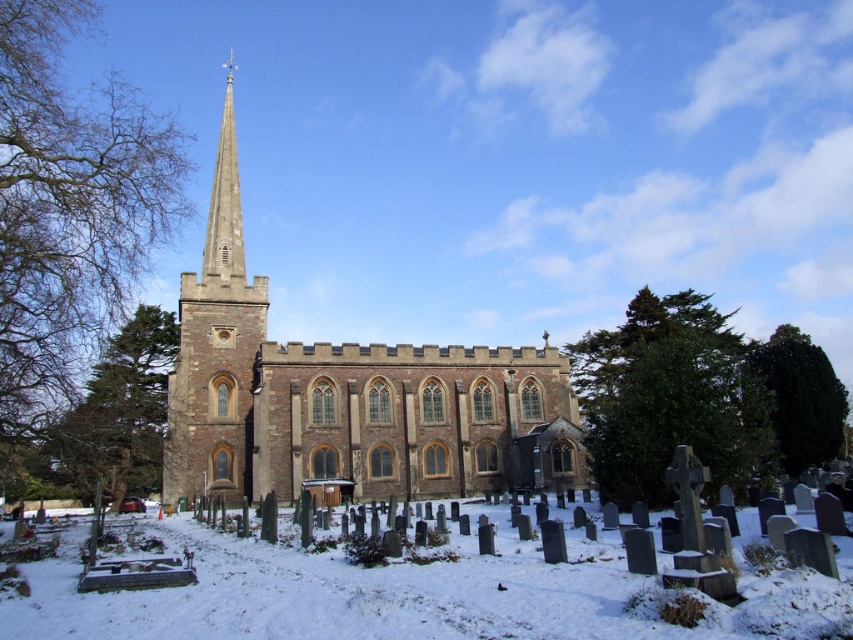
You are standing in a snowy graveyard and want to take a photo of the brown stone church at center. If your camera can focus on objects up to 200 feet away, will you need to move closer to get a clear shot?

The brown stone church at center is 225.36 feet away from the viewer, which is beyond the camera focus range of 200 feet. You need to move closer to ensure the church is in focus.

You are a photographer standing at the edge of the graveyard. You want to take a picture that includes both the brown stone church at center and the white powdery snow at lower center. Which object will appear larger in the photo?

The brown stone church at center will appear larger in the photo because it is taller than the white powdery snow at lower center.